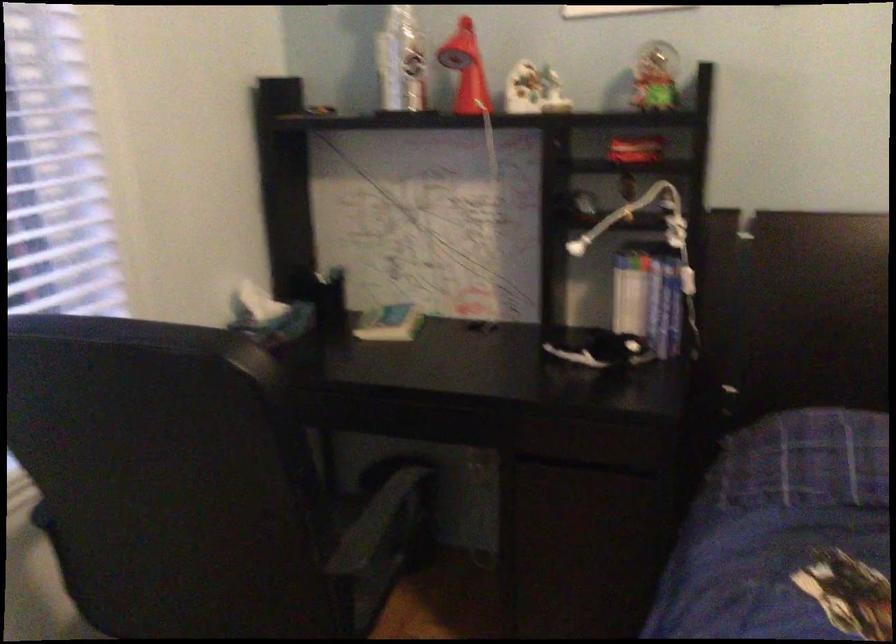
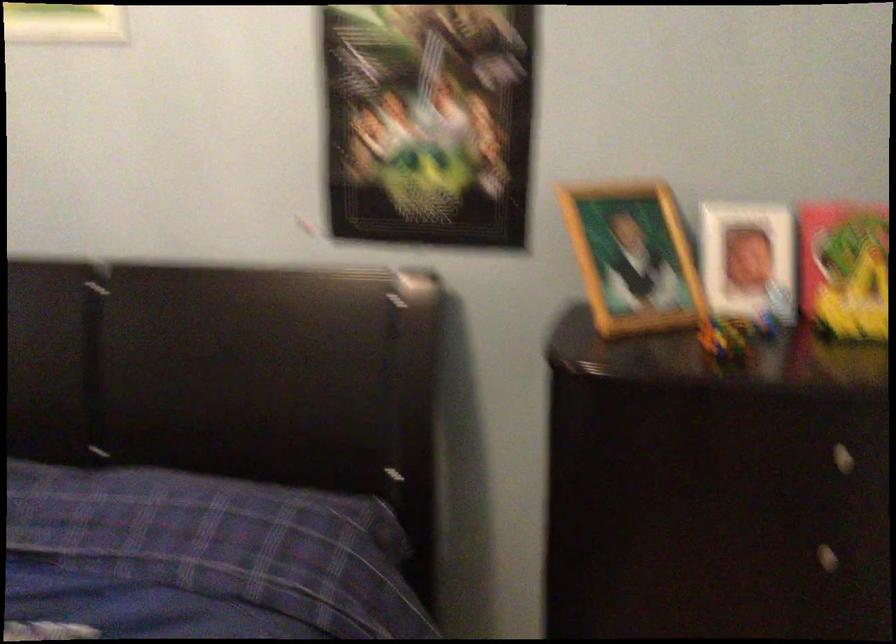
Question: What movement of the cameraman would produce the second image?

Choices:
 (A) Left
 (B) Right
 (C) Forward
 (D) Backward

Answer: (B)